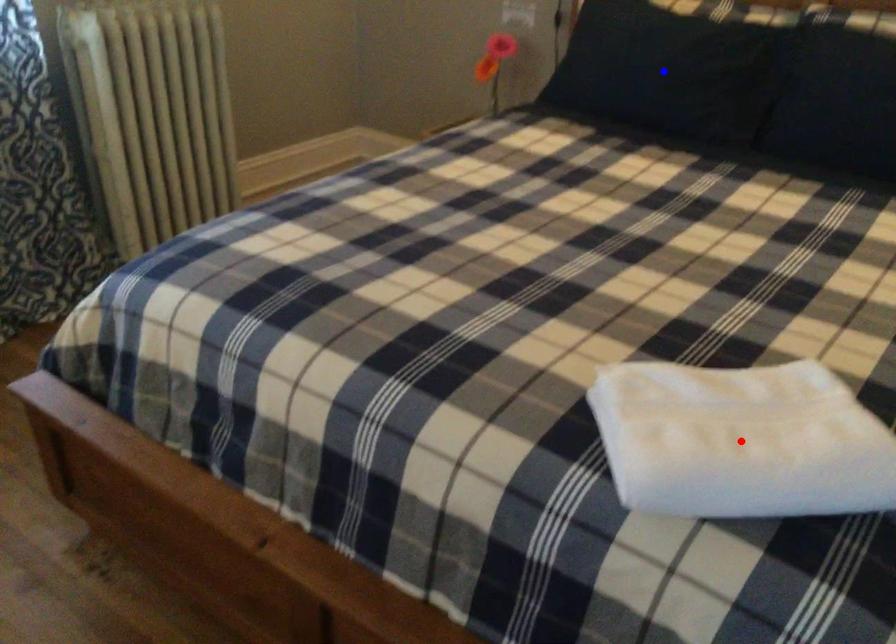
Question: Which of the two points in the image is closer to the camera?

Choices:
 (A) Blue point is closer.
 (B) Red point is closer.

Answer: (B)